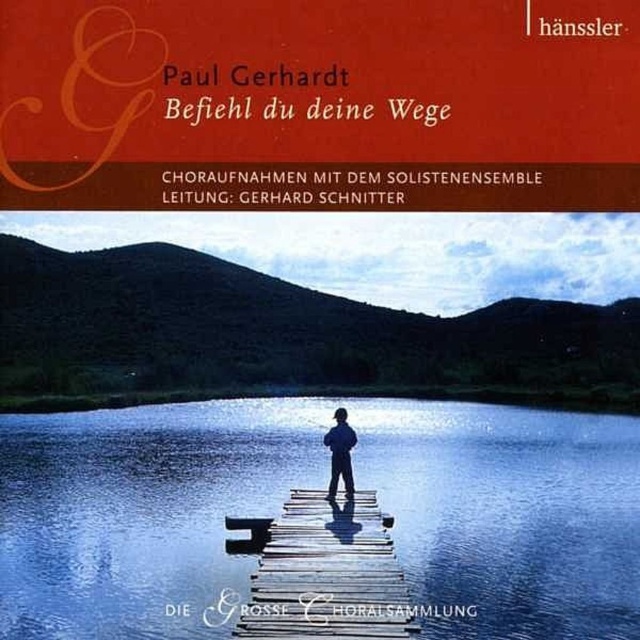
Question: Is matte orange book cover at upper center smaller than blue fabric person at center?

Choices:
 (A) yes
 (B) no

Answer: (B)

Question: Which object is the closest to the blue fabric person at center?

Choices:
 (A) blue reflective water at center
 (B) matte orange book cover at upper center
 (C) wooden at center

Answer: (C)

Question: Which is nearer to the wooden at center?

Choices:
 (A) blue reflective water at center
 (B) matte orange book cover at upper center
 (C) blue fabric person at center

Answer: (C)

Question: Is wooden at center closer to camera compared to blue fabric person at center?

Choices:
 (A) yes
 (B) no

Answer: (A)

Question: Among these points, which one is farthest from the camera?

Choices:
 (A) (188, 64)
 (B) (365, 595)

Answer: (B)

Question: Can you confirm if wooden at center is positioned below blue fabric person at center?

Choices:
 (A) yes
 (B) no

Answer: (A)